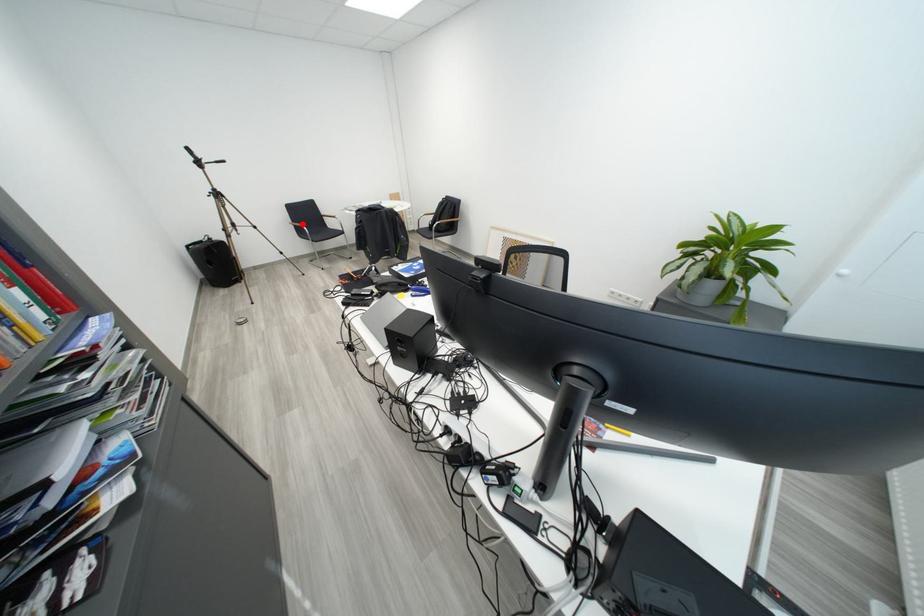
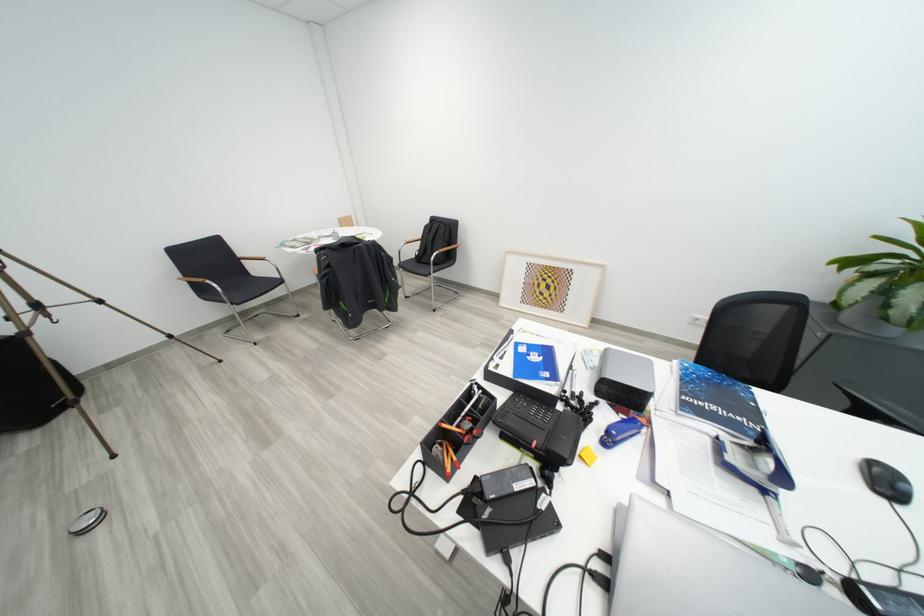
Question: I am providing you with two images of the same scene from different viewpoints. In image1, a red point is highlighted. Considering the same 3D point in image2, which of the following is correct?

Choices:
 (A) It is closer
 (B) It is farther

Answer: (B)